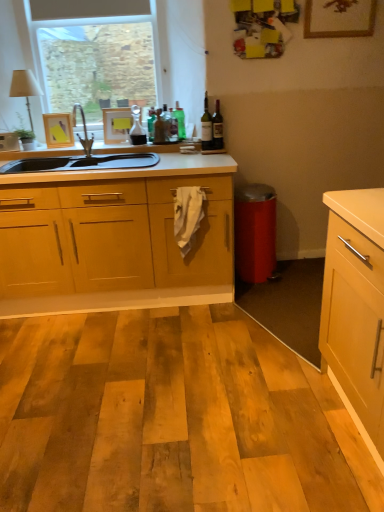
What do you see at coordinates (58, 130) in the screenshot? I see `wooden photo frame at upper left, arranged as the third picture frame when viewed from the top` at bounding box center [58, 130].

The width and height of the screenshot is (384, 512). What do you see at coordinates (206, 127) in the screenshot? I see `translucent glass wine bottle at upper center, the third bottle viewed from the left` at bounding box center [206, 127].

Where is `translucent glass wine bottle at upper center, the third bottle viewed from the left`? Image resolution: width=384 pixels, height=512 pixels. translucent glass wine bottle at upper center, the third bottle viewed from the left is located at coordinates (206, 127).

This screenshot has height=512, width=384. What do you see at coordinates (180, 121) in the screenshot?
I see `green glass bottle at upper center, which ranks as the 3th bottle in right-to-left order` at bounding box center [180, 121].

Identify the location of translucent glass carafe at center, the 4th bottle from the right. This screenshot has width=384, height=512. (137, 128).

Considering the relative sizes of matte white picture frame at upper center, marked as the second picture frame in a top-to-bottom arrangement, and metallic faucet at upper left in the image provided, is matte white picture frame at upper center, marked as the second picture frame in a top-to-bottom arrangement, shorter than metallic faucet at upper left?

Yes, matte white picture frame at upper center, marked as the second picture frame in a top-to-bottom arrangement, is shorter than metallic faucet at upper left.

From the image's perspective, is matte white picture frame at upper center, which is the second picture frame from left to right, located beneath metallic faucet at upper left?

No, from the image's perspective, matte white picture frame at upper center, which is the second picture frame from left to right, is not below metallic faucet at upper left.

Is matte white picture frame at upper center, the second picture frame when ordered from right to left, oriented away from metallic faucet at upper left?

matte white picture frame at upper center, the second picture frame when ordered from right to left, is not turned away from metallic faucet at upper left.

Is point (124, 116) closer or farther from the camera than point (87, 135)?

Clearly, point (124, 116) is closer to the camera than point (87, 135).

Is point (181, 130) closer to camera compared to point (74, 124)?

Yes, point (181, 130) is closer to viewer.

Is green glass bottle at upper center, which ranks as the 3th bottle in right-to-left order, not close to metallic faucet at upper left?

They are positioned close to each other.

From a real-world perspective, does green glass bottle at upper center, which ranks as the 3th bottle in right-to-left order, sit lower than metallic faucet at upper left?

Yes, from a real-world perspective, green glass bottle at upper center, which ranks as the 3th bottle in right-to-left order, is below metallic faucet at upper left.

Is green glass bottle at upper center, the 2th bottle from the left, turned away from metallic faucet at upper left?

No, green glass bottle at upper center, the 2th bottle from the left, is not facing away from metallic faucet at upper left.

You are a GUI agent. You are given a task and a screenshot of the screen. Output one action in this format:
    pyautogui.click(x=<x>, y=<y>)
    Task: Click on the faucet above the translucent glass carafe at center, the 4th bottle from the right (from a real-world perspective)
    Image resolution: width=384 pixels, height=512 pixels.
    Given the screenshot: What is the action you would take?
    pyautogui.click(x=84, y=131)

Considering the sizes of metallic faucet at upper left and translucent glass carafe at center, positioned as the 1th bottle in left-to-right order, in the image, is metallic faucet at upper left bigger or smaller than translucent glass carafe at center, positioned as the 1th bottle in left-to-right order,?

Clearly, metallic faucet at upper left is larger in size than translucent glass carafe at center, positioned as the 1th bottle in left-to-right order.

Which object is positioned more to the right, metallic faucet at upper left or translucent glass carafe at center, the 4th bottle from the right?

translucent glass carafe at center, the 4th bottle from the right.

Is metallic faucet at upper left placed right next to translucent glass carafe at center, positioned as the 1th bottle in left-to-right order?

No, metallic faucet at upper left is not making contact with translucent glass carafe at center, positioned as the 1th bottle in left-to-right order.

Who is taller, translucent glass wine bottle at upper center, the second bottle from the right, or translucent glass wine bottle at upper center, the 4th bottle from the left?

translucent glass wine bottle at upper center, the second bottle from the right.

Choose the correct answer: Is translucent glass wine bottle at upper center, the second bottle from the right, inside translucent glass wine bottle at upper center, the 4th bottle from the left, or outside it?

translucent glass wine bottle at upper center, the second bottle from the right, is not inside translucent glass wine bottle at upper center, the 4th bottle from the left, it's outside.

Does point (207, 105) come farther from viewer compared to point (213, 123)?

Yes.

Could you tell me if translucent glass wine bottle at upper center, the second bottle from the right, is facing translucent glass wine bottle at upper center, the 4th bottle from the left?

No, translucent glass wine bottle at upper center, the second bottle from the right, is not facing towards translucent glass wine bottle at upper center, the 4th bottle from the left.

Is matte white picture frame at upper center, the 1th picture frame viewed from the back, not within translucent glass carafe at center, the 4th bottle from the right?

That's correct, matte white picture frame at upper center, the 1th picture frame viewed from the back, is outside of translucent glass carafe at center, the 4th bottle from the right.

Can you see matte white picture frame at upper center, which is the second picture frame from left to right, touching translucent glass carafe at center, the 4th bottle from the right?

No, matte white picture frame at upper center, which is the second picture frame from left to right, is not beside translucent glass carafe at center, the 4th bottle from the right.

From a real-world perspective, which is physically above, matte white picture frame at upper center, the second picture frame when ordered from right to left, or translucent glass carafe at center, the 4th bottle from the right?

translucent glass carafe at center, the 4th bottle from the right.

Where is `the 1st bottle below when counting from the matte white picture frame at upper center, the second picture frame when ordered from right to left (from the image's perspective)`? The height and width of the screenshot is (512, 384). the 1st bottle below when counting from the matte white picture frame at upper center, the second picture frame when ordered from right to left (from the image's perspective) is located at coordinates pyautogui.click(x=137, y=128).

Where is `picture frame on the right of matte white picture frame at upper center, which is the second picture frame from left to right`? The width and height of the screenshot is (384, 512). picture frame on the right of matte white picture frame at upper center, which is the second picture frame from left to right is located at coordinates (339, 18).

Does wooden picture frame at upper center, marked as the 3th picture frame in a bottom-to-top arrangement, have a lesser height compared to matte white picture frame at upper center, the second picture frame when ordered from right to left?

No.

Is point (354, 29) in front of point (111, 110)?

That is True.

Is wooden picture frame at upper center, the third picture frame positioned from the left, further to camera compared to matte white picture frame at upper center, which is the second picture frame from left to right?

No, it is not.

Who is shorter, wooden picture frame at upper center, the first picture frame viewed from the front, or translucent glass wine bottle at upper center, acting as the first bottle starting from the right?

translucent glass wine bottle at upper center, acting as the first bottle starting from the right, is shorter.

Is wooden picture frame at upper center, the first picture frame viewed from the front, smaller than translucent glass wine bottle at upper center, the 4th bottle from the left?

Actually, wooden picture frame at upper center, the first picture frame viewed from the front, might be larger than translucent glass wine bottle at upper center, the 4th bottle from the left.

Between wooden picture frame at upper center, which appears as the 1th picture frame when viewed from the right, and translucent glass wine bottle at upper center, acting as the first bottle starting from the right, which one has smaller width?

wooden picture frame at upper center, which appears as the 1th picture frame when viewed from the right.

Is wooden picture frame at upper center, the third picture frame viewed from the back, not near translucent glass wine bottle at upper center, the 4th bottle from the left?

No, wooden picture frame at upper center, the third picture frame viewed from the back, is not far away from translucent glass wine bottle at upper center, the 4th bottle from the left.

At what (x,y) coordinates should I click in order to perform the action: click on the 2nd picture frame above the metallic faucet at upper left (from the image's perspective). Please return your answer as a coordinate pair (x, y). This screenshot has height=512, width=384. Looking at the image, I should click on (116, 124).

Locate an element on the screen. Image resolution: width=384 pixels, height=512 pixels. faucet on the left of green glass bottle at upper center, which ranks as the 3th bottle in right-to-left order is located at coordinates (84, 131).

From the image, which object appears to be farther from wooden picture frame at upper center, the third picture frame viewed from the back, translucent glass wine bottle at upper center, the 4th bottle from the left, or green glass bottle at upper center, which ranks as the 3th bottle in right-to-left order?

green glass bottle at upper center, which ranks as the 3th bottle in right-to-left order, lies further to wooden picture frame at upper center, the third picture frame viewed from the back, than the other object.

From the image, which object appears to be farther from translucent glass wine bottle at upper center, the third bottle viewed from the left, green glass bottle at upper center, which ranks as the 3th bottle in right-to-left order, or translucent glass wine bottle at upper center, the 4th bottle from the left?

Based on the image, green glass bottle at upper center, which ranks as the 3th bottle in right-to-left order, appears to be further to translucent glass wine bottle at upper center, the third bottle viewed from the left.

Which object lies further to the anchor point translucent glass carafe at center, positioned as the 1th bottle in left-to-right order, translucent glass wine bottle at upper center, acting as the first bottle starting from the right, or metallic faucet at upper left?

Among the two, translucent glass wine bottle at upper center, acting as the first bottle starting from the right, is located further to translucent glass carafe at center, positioned as the 1th bottle in left-to-right order.

Considering their positions, is translucent glass wine bottle at upper center, acting as the first bottle starting from the right, positioned further to wooden picture frame at upper center, the third picture frame positioned from the left, than wooden photo frame at upper left, which is the second picture frame in back-to-front order?

wooden photo frame at upper left, which is the second picture frame in back-to-front order, is further to wooden picture frame at upper center, the third picture frame positioned from the left.

Looking at the image, which one is located closer to green glass bottle at upper center, which ranks as the 3th bottle in right-to-left order, wooden picture frame at upper center, the third picture frame viewed from the back, or matte white picture frame at upper center, marked as the second picture frame in a top-to-bottom arrangement?

Based on the image, matte white picture frame at upper center, marked as the second picture frame in a top-to-bottom arrangement, appears to be nearer to green glass bottle at upper center, which ranks as the 3th bottle in right-to-left order.

Considering their positions, is metallic faucet at upper left positioned further to translucent glass wine bottle at upper center, the third bottle viewed from the left, than translucent glass wine bottle at upper center, acting as the first bottle starting from the right?

metallic faucet at upper left lies further to translucent glass wine bottle at upper center, the third bottle viewed from the left, than the other object.

Based on their spatial positions, is wooden photo frame at upper left, which is the first picture frame from bottom to top, or matte white picture frame at upper center, which is the second picture frame from left to right, further from green glass bottle at upper center, the 2th bottle from the left?

Among the two, wooden photo frame at upper left, which is the first picture frame from bottom to top, is located further to green glass bottle at upper center, the 2th bottle from the left.

Considering their positions, is matte white picture frame at upper center, which appears as the second picture frame when ordered from the bottom, positioned further to wooden picture frame at upper center, which is counted as the 1th picture frame, starting from the top, than translucent glass wine bottle at upper center, acting as the first bottle starting from the right?

Based on the image, matte white picture frame at upper center, which appears as the second picture frame when ordered from the bottom, appears to be further to wooden picture frame at upper center, which is counted as the 1th picture frame, starting from the top.

You are a GUI agent. You are given a task and a screenshot of the screen. Output one action in this format:
    pyautogui.click(x=<x>, y=<y>)
    Task: Click on the faucet situated between wooden photo frame at upper left, the second picture frame from the front, and wooden picture frame at upper center, the third picture frame positioned from the left, from left to right
    
    Given the screenshot: What is the action you would take?
    pyautogui.click(x=84, y=131)

This screenshot has height=512, width=384. I want to click on picture frame located between metallic faucet at upper left and wooden picture frame at upper center, the third picture frame viewed from the back, in the left-right direction, so click(116, 124).

Find the location of `faucet located between wooden photo frame at upper left, which is the first picture frame in left-to-right order, and translucent glass wine bottle at upper center, the 4th bottle from the left, in the left-right direction`. faucet located between wooden photo frame at upper left, which is the first picture frame in left-to-right order, and translucent glass wine bottle at upper center, the 4th bottle from the left, in the left-right direction is located at coordinates (84, 131).

The width and height of the screenshot is (384, 512). I want to click on bottle between wooden photo frame at upper left, which is the first picture frame in left-to-right order, and green glass bottle at upper center, the 2th bottle from the left, from left to right, so 137,128.